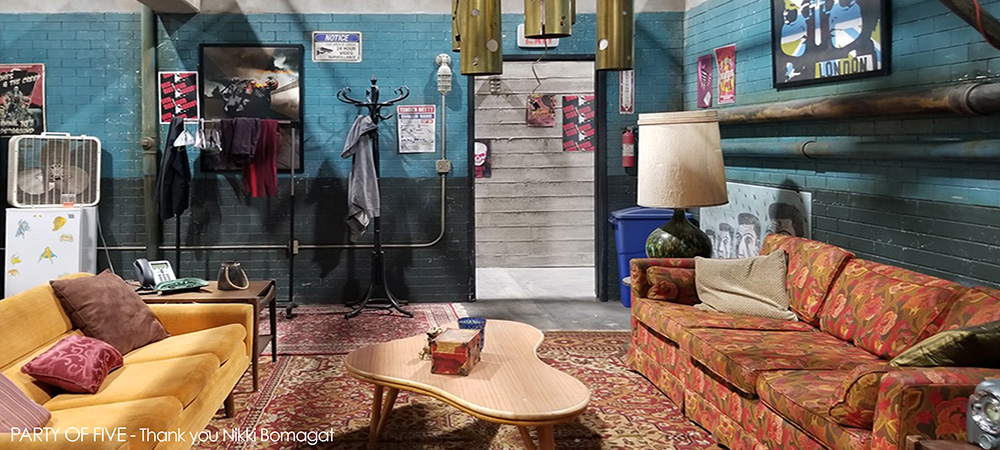
Identify the location of beige lampshade. This screenshot has width=1000, height=450. (673, 150).